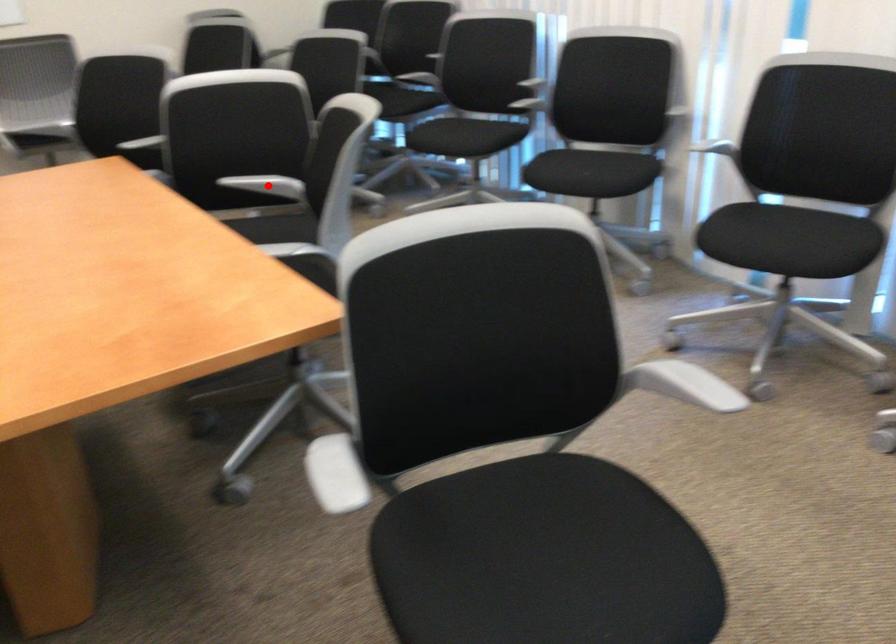
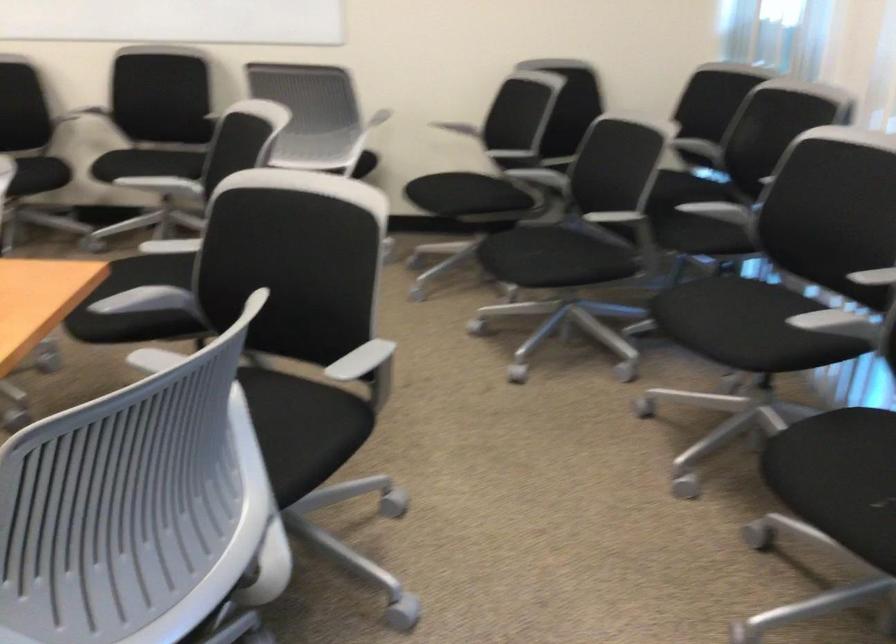
Question: I am providing you with two images of the same scene from different viewpoints. A red point is marked on the first image. Can you still see the location of the red point in image 2?

Choices:
 (A) Yes
 (B) No

Answer: (B)